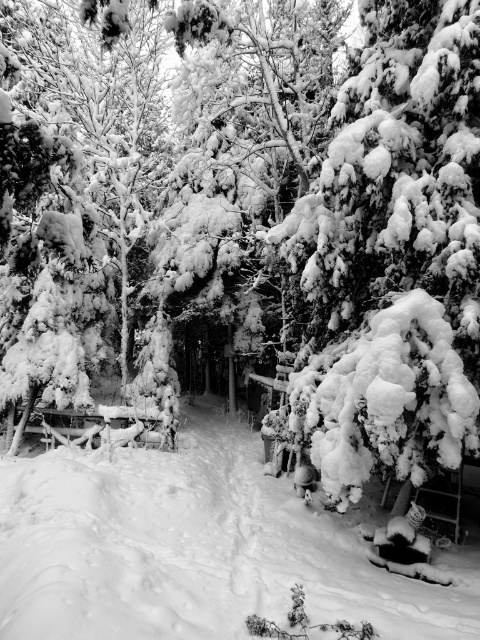
Question: Is snow-covered evergreen at right in front of white fluffy snow at center?

Choices:
 (A) yes
 (B) no

Answer: (B)

Question: Which object appears closest to the camera in this image?

Choices:
 (A) white fluffy snow at center
 (B) snow-covered evergreen at right

Answer: (A)

Question: Which point is farther to the camera?

Choices:
 (A) (280, 531)
 (B) (374, 378)

Answer: (A)

Question: Is snow-covered evergreen at right thinner than white fluffy snow at center?

Choices:
 (A) no
 (B) yes

Answer: (B)

Question: Observing the image, what is the correct spatial positioning of snow-covered evergreen at right in reference to white fluffy snow at center?

Choices:
 (A) above
 (B) below

Answer: (A)